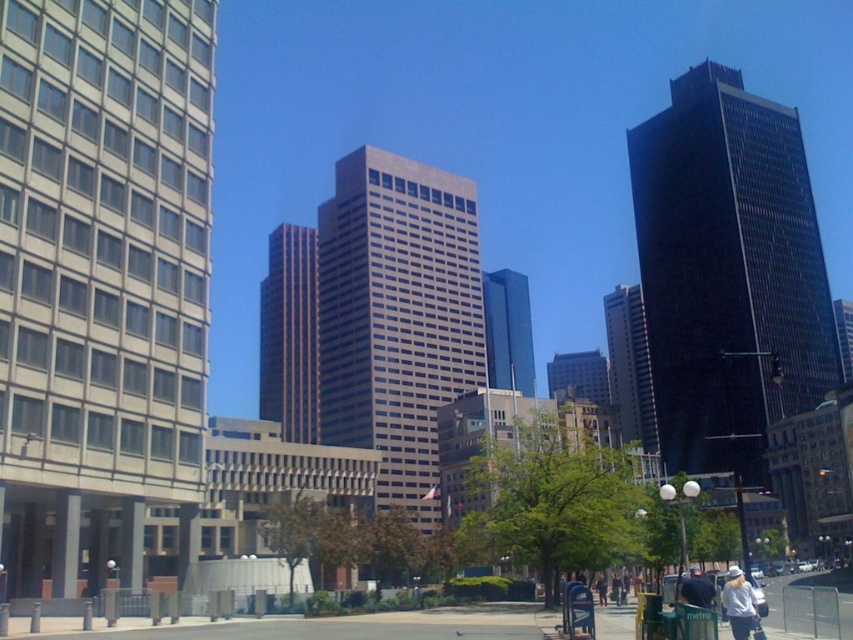
Identify the location of gray concrete pavement at lower center. pos(323,628).

Who is positioned more to the left, gray concrete pavement at lower center or white cotton shirt at lower right?

From the viewer's perspective, gray concrete pavement at lower center appears more on the left side.

Locate an element on the screen. Image resolution: width=853 pixels, height=640 pixels. gray concrete pavement at lower center is located at coordinates (323, 628).